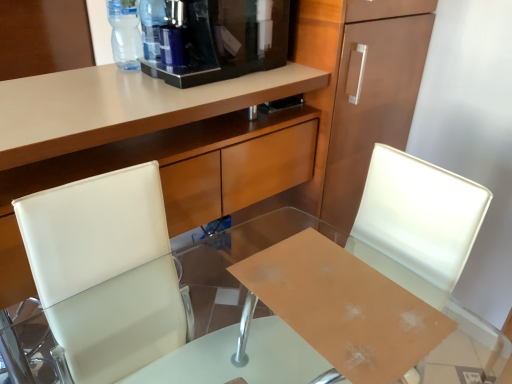
You are a GUI agent. You are given a task and a screenshot of the screen. Output one action in this format:
    pyautogui.click(x=<x>, y=<y>)
    Task: Click on the free spot in front of transparent plastic bottle at upper center, placed as the 1th bottle when sorted from right to left
    
    Given the screenshot: What is the action you would take?
    [143, 78]